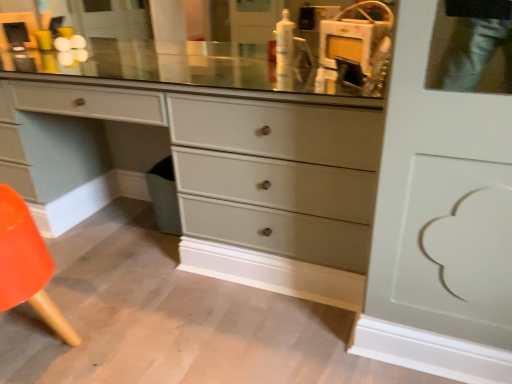
Question: Is matte gray dresser at center to the right of white glossy lotion at upper center from the viewer's perspective?

Choices:
 (A) yes
 (B) no

Answer: (B)

Question: Is matte gray dresser at center located outside white glossy lotion at upper center?

Choices:
 (A) no
 (B) yes

Answer: (B)

Question: Considering the relative positions of matte gray dresser at center and white glossy lotion at upper center in the image provided, is matte gray dresser at center behind white glossy lotion at upper center?

Choices:
 (A) no
 (B) yes

Answer: (A)

Question: Is matte gray dresser at center facing towards white glossy lotion at upper center?

Choices:
 (A) yes
 (B) no

Answer: (B)

Question: Could white glossy lotion at upper center be considered to be inside matte gray dresser at center?

Choices:
 (A) no
 (B) yes

Answer: (A)

Question: Is point (263, 144) positioned closer to the camera than point (290, 74)?

Choices:
 (A) farther
 (B) closer

Answer: (B)

Question: Considering their positions, is matte gray dresser at center located in front of or behind white glossy lotion at upper center?

Choices:
 (A) front
 (B) behind

Answer: (A)

Question: Considering the positions of matte gray dresser at center and white glossy lotion at upper center in the image, is matte gray dresser at center bigger or smaller than white glossy lotion at upper center?

Choices:
 (A) small
 (B) big

Answer: (B)

Question: Is matte gray dresser at center wider or thinner than white glossy lotion at upper center?

Choices:
 (A) thin
 (B) wide

Answer: (B)

Question: In terms of size, does white glossy lotion at upper center appear bigger or smaller than orange plastic chair at lower left?

Choices:
 (A) small
 (B) big

Answer: (A)

Question: Is white glossy lotion at upper center in front of or behind orange plastic chair at lower left in the image?

Choices:
 (A) front
 (B) behind

Answer: (B)

Question: Is white glossy lotion at upper center spatially inside orange plastic chair at lower left, or outside of it?

Choices:
 (A) inside
 (B) outside

Answer: (B)

Question: In terms of width, does white glossy lotion at upper center look wider or thinner when compared to orange plastic chair at lower left?

Choices:
 (A) wide
 (B) thin

Answer: (B)

Question: Considering the positions of matte gray dresser at center and orange plastic chair at lower left in the image, is matte gray dresser at center taller or shorter than orange plastic chair at lower left?

Choices:
 (A) tall
 (B) short

Answer: (A)

Question: From a real-world perspective, is matte gray dresser at center physically located above or below orange plastic chair at lower left?

Choices:
 (A) below
 (B) above

Answer: (B)